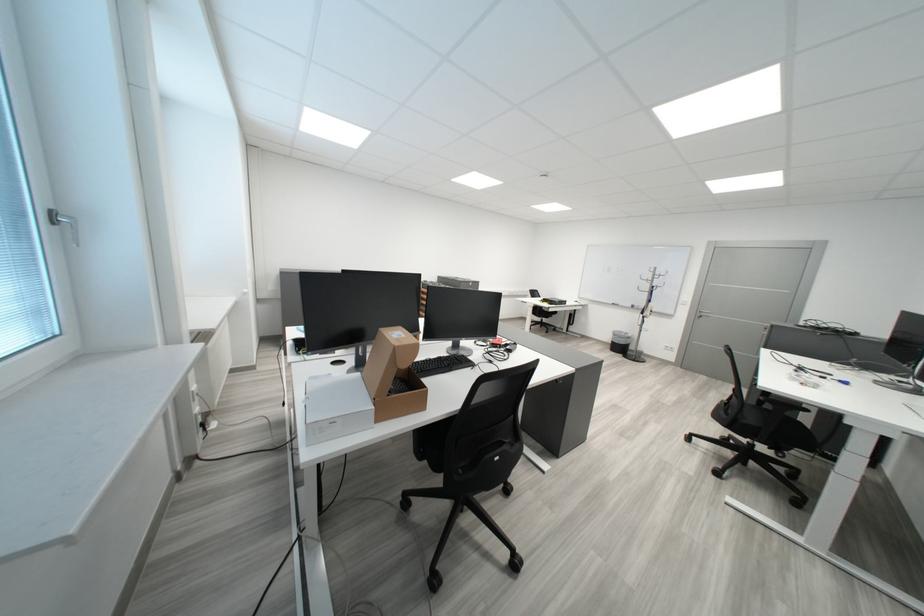
Where is `chair sitting surface`? chair sitting surface is located at coordinates (771, 419).